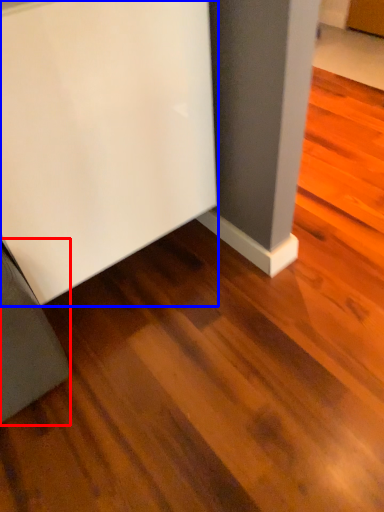
Question: Among these objects, which one is nearest to the camera, furniture (highlighted by a red box) or furniture (highlighted by a blue box)?

Choices:
 (A) furniture
 (B) furniture

Answer: (B)